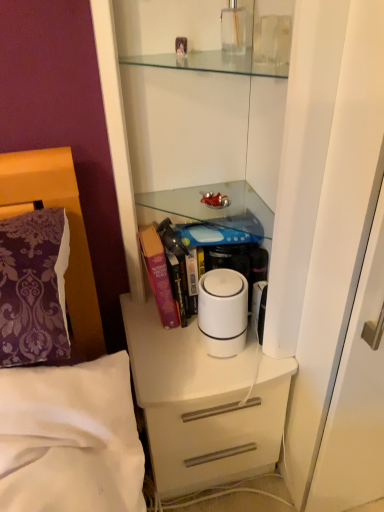
Locate an element on the screen. Image resolution: width=384 pixels, height=512 pixels. free space in front of purple hardcover book at center is located at coordinates (198, 368).